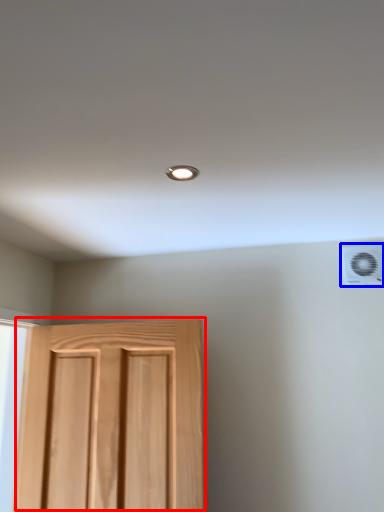
Question: Which of the following is the closest to the observer, door (highlighted by a red box) or air conditioning (highlighted by a blue box)?

Choices:
 (A) door
 (B) air conditioning

Answer: (A)